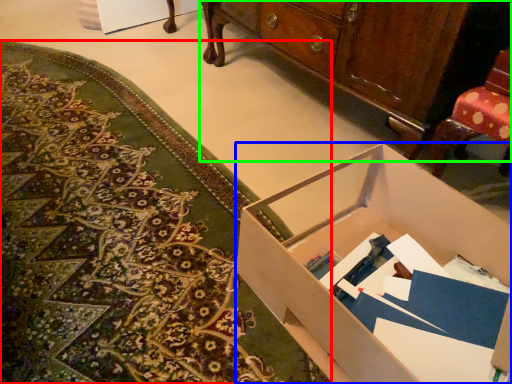
Question: Estimate the real-world distances between objects in this image. Which object is closer to mat (highlighted by a red box), desk (highlighted by a blue box) or cabinetry (highlighted by a green box)?

Choices:
 (A) desk
 (B) cabinetry

Answer: (A)